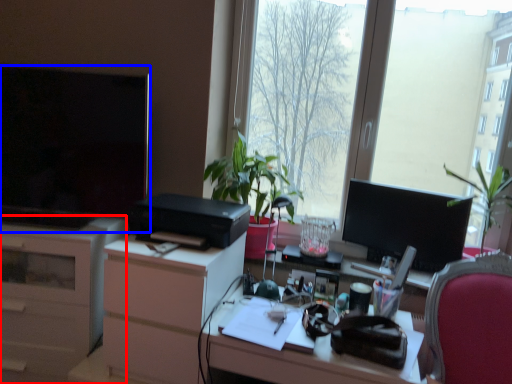
Question: Among these objects, which one is farthest to the camera, cabinetry (highlighted by a red box) or television (highlighted by a blue box)?

Choices:
 (A) cabinetry
 (B) television

Answer: (A)